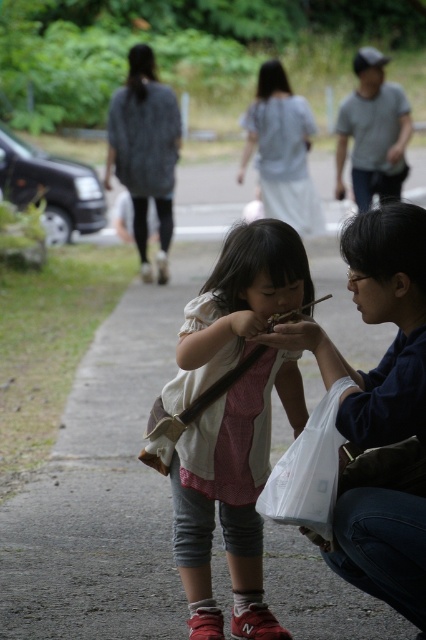
Based on the photo, who is more distant from viewer, (276, 100) or (305, 483)?

Positioned behind is point (276, 100).

The height and width of the screenshot is (640, 426). Describe the element at coordinates (282, 150) in the screenshot. I see `light gray cotton shirt at center` at that location.

Image resolution: width=426 pixels, height=640 pixels. What are the coordinates of `light gray cotton shirt at center` in the screenshot? It's located at (282, 150).

Which is in front, point (356, 524) or point (379, 90)?

Point (356, 524) is in front.

Which is below, white plastic bag at center or gray cotton shirt at upper right?

white plastic bag at center

This screenshot has width=426, height=640. In order to click on white plastic bag at center in this screenshot , I will do `click(377, 323)`.

Locate an element on the screen. Image resolution: width=426 pixels, height=640 pixels. white plastic bag at center is located at coordinates (377, 323).

Who is taller, white cotton shirt at center or white plastic bag at lower right?

With more height is white cotton shirt at center.

Who is positioned more to the right, white cotton shirt at center or white plastic bag at lower right?

Positioned to the right is white plastic bag at lower right.

At what (x,y) coordinates should I click in order to perform the action: click on white cotton shirt at center. Please return your answer as a coordinate pair (x, y). Looking at the image, I should click on (230, 496).

Identify the location of white cotton shirt at center. The image size is (426, 640). (230, 496).